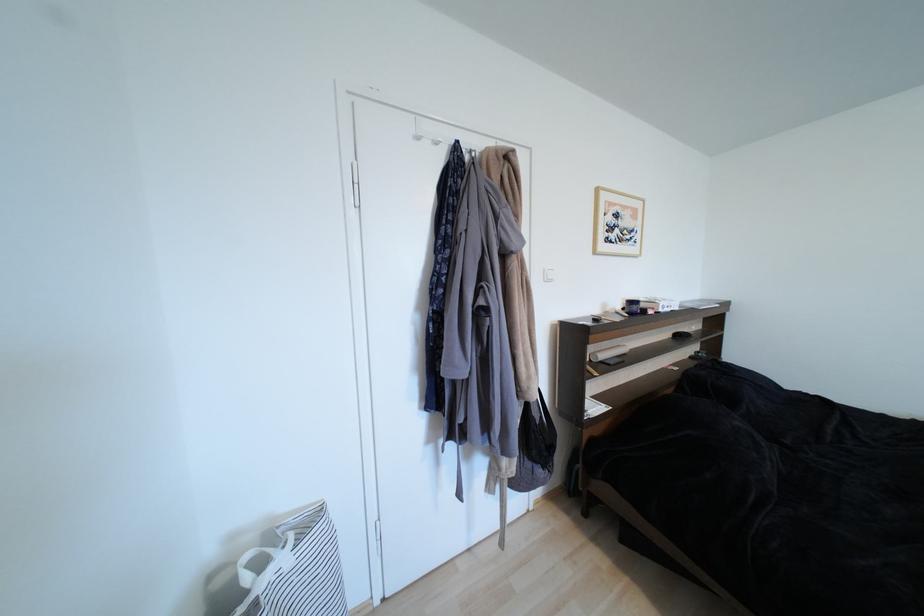
This screenshot has height=616, width=924. What do you see at coordinates (264, 562) in the screenshot?
I see `the white bag handle` at bounding box center [264, 562].